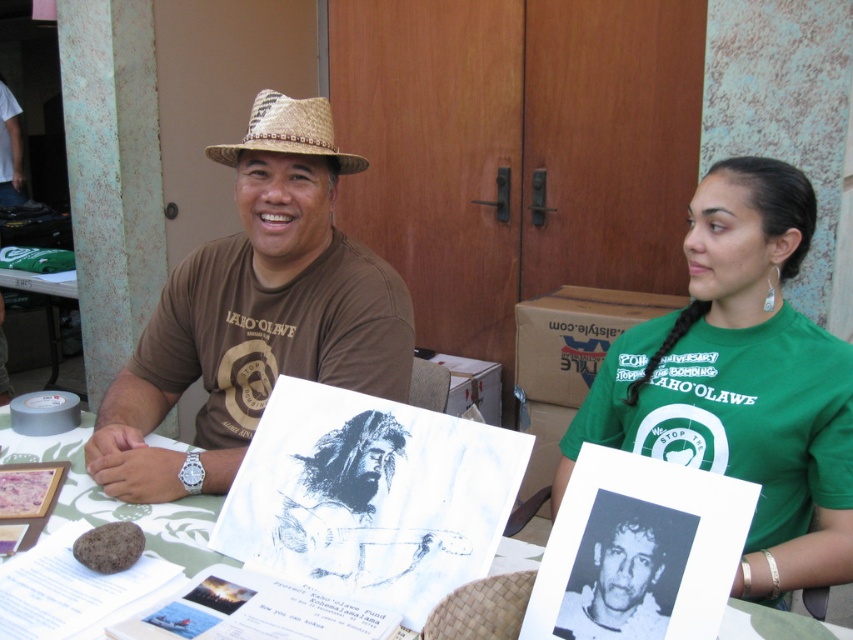
Can you confirm if green fabric shirt at upper right is positioned above white paper at center?

Indeed, green fabric shirt at upper right is positioned over white paper at center.

Does point (721, 468) come behind point (142, 522)?

Yes, it is.

Is point (755, 426) positioned after point (183, 563)?

Yes, point (755, 426) is farther from viewer.

Locate an element on the screen. The width and height of the screenshot is (853, 640). green fabric shirt at upper right is located at coordinates (741, 381).

Can you confirm if green fabric shirt at upper right is positioned to the right of brown straw hat at center?

Correct, you'll find green fabric shirt at upper right to the right of brown straw hat at center.

Is green fabric shirt at upper right wider than brown straw hat at center?

Incorrect, green fabric shirt at upper right's width does not surpass brown straw hat at center's.

I want to click on green fabric shirt at upper right, so click(741, 381).

The height and width of the screenshot is (640, 853). In order to click on green fabric shirt at upper right in this screenshot , I will do `click(741, 381)`.

From the picture: Can you confirm if white paper at center is bigger than straw woven hat at upper center?

Yes, white paper at center is bigger than straw woven hat at upper center.

Can you confirm if white paper at center is smaller than straw woven hat at upper center?

Incorrect, white paper at center is not smaller in size than straw woven hat at upper center.

In order to click on white paper at center in this screenshot , I will do point(117,500).